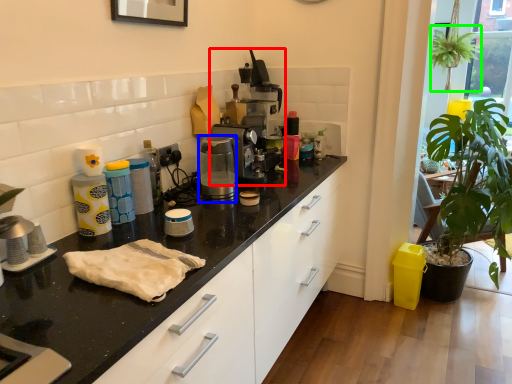
Question: Which object is the farthest from coffee machine (highlighted by a red box)? Choose among these: coffee machine (highlighted by a blue box) or plant (highlighted by a green box).

Choices:
 (A) coffee machine
 (B) plant

Answer: (B)